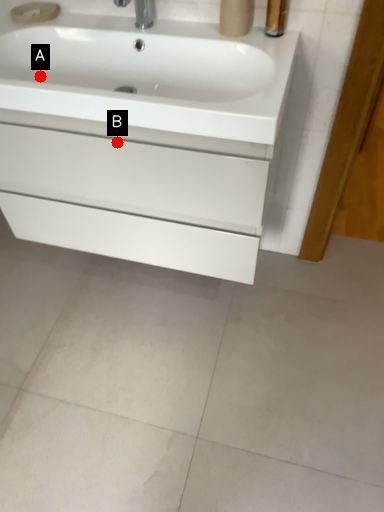
Question: Two points are circled on the image, labeled by A and B beside each circle. Which of the following is the farthest from the observer?

Choices:
 (A) A is further
 (B) B is further

Answer: (A)